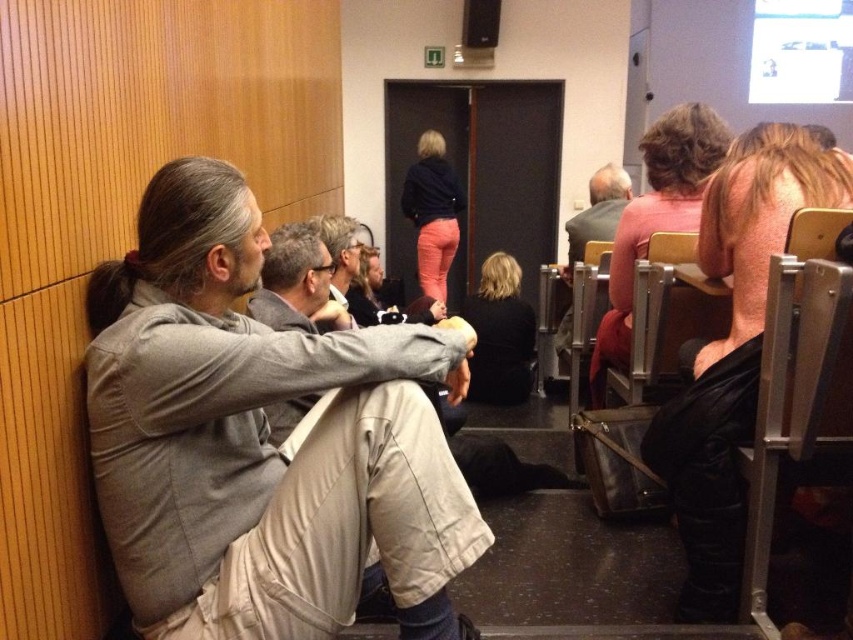
Question: Is matte black jacket at right to the left of gray fabric jacket at center from the viewer's perspective?

Choices:
 (A) no
 (B) yes

Answer: (A)

Question: Which of the following is the closest to the observer?

Choices:
 (A) matte black sweater at center
 (B) dark green sweater at center
 (C) blonde hair at center

Answer: (B)

Question: Which point is farther to the camera?

Choices:
 (A) dark green sweater at center
 (B) light gray jacket at left

Answer: (A)

Question: Is matte black jacket at right below dark green sweater at center?

Choices:
 (A) yes
 (B) no

Answer: (A)

Question: Which object appears closest to the camera in this image?

Choices:
 (A) blonde hair at center
 (B) gray fabric jacket at center
 (C) matte gray jacket at center
 (D) matte black jacket at right

Answer: (D)

Question: Can you confirm if matte pink sweater at center right is bigger than matte black sweater at center?

Choices:
 (A) no
 (B) yes

Answer: (A)